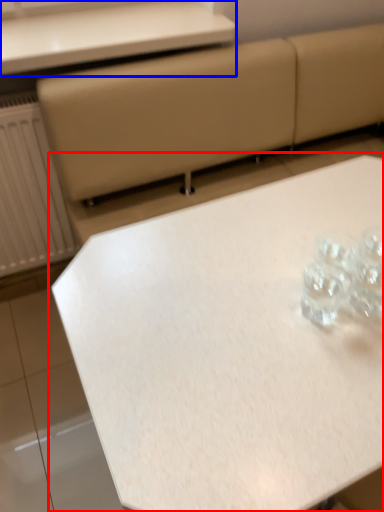
Question: Which of the following is the closest to the observer, table (highlighted by a red box) or table (highlighted by a blue box)?

Choices:
 (A) table
 (B) table

Answer: (A)